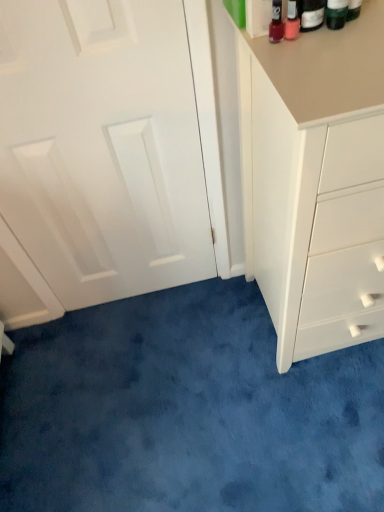
The image size is (384, 512). Describe the element at coordinates (102, 147) in the screenshot. I see `white matte door at center` at that location.

What are the coordinates of `white matte door at center` in the screenshot? It's located at (102, 147).

Identify the location of white matte door at center. This screenshot has width=384, height=512. (102, 147).